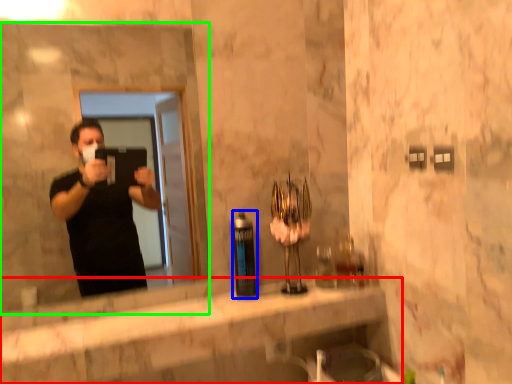
Question: Which is farther away from counter top (highlighted by a red box)? bottle (highlighted by a blue box) or mirror (highlighted by a green box)?

Choices:
 (A) bottle
 (B) mirror

Answer: (B)